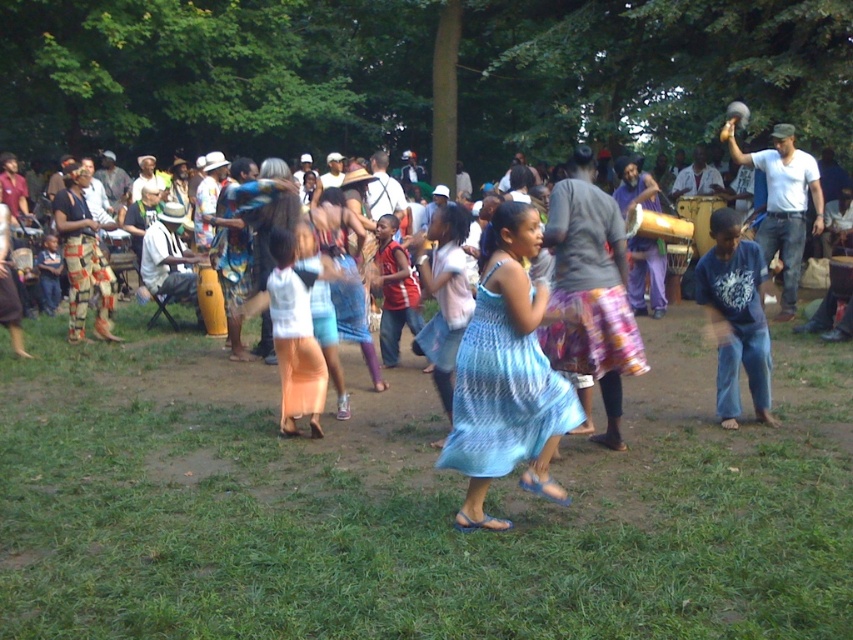
You are a photographer at the community gathering and want to capture a photo that includes both the green grass at center and the blue knitted dress at center. Based on their positions, which object is closer to the camera?

The blue knitted dress at center is closer to the camera because it is positioned over the green grass at center, indicating it is in front.

Consider the image. You are standing at the camera position and want to reach the point marked as point [138,636]. If you have a 14 feet long rope, can you reach it using the rope?

The point [138,636] is 13.94 feet from the camera, so yes, the 14 feet long rope is sufficient to reach it.

You are standing at the origin point of the coordinate system in the image. You want to walk to the green grass at center. Which direction should you move in?

The green grass at center is located at coordinate point (408,508), so you should move towards the right and upward direction from your current position at the origin.